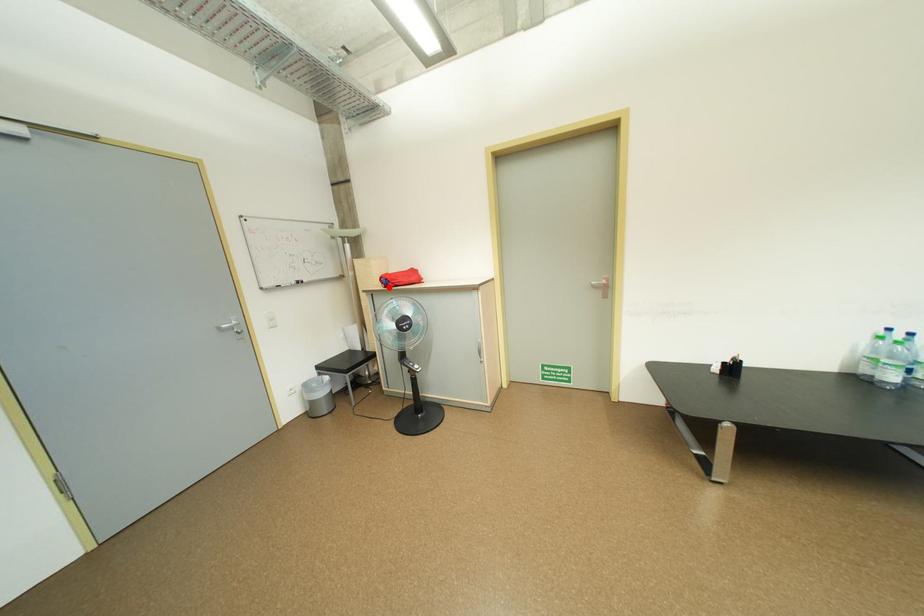
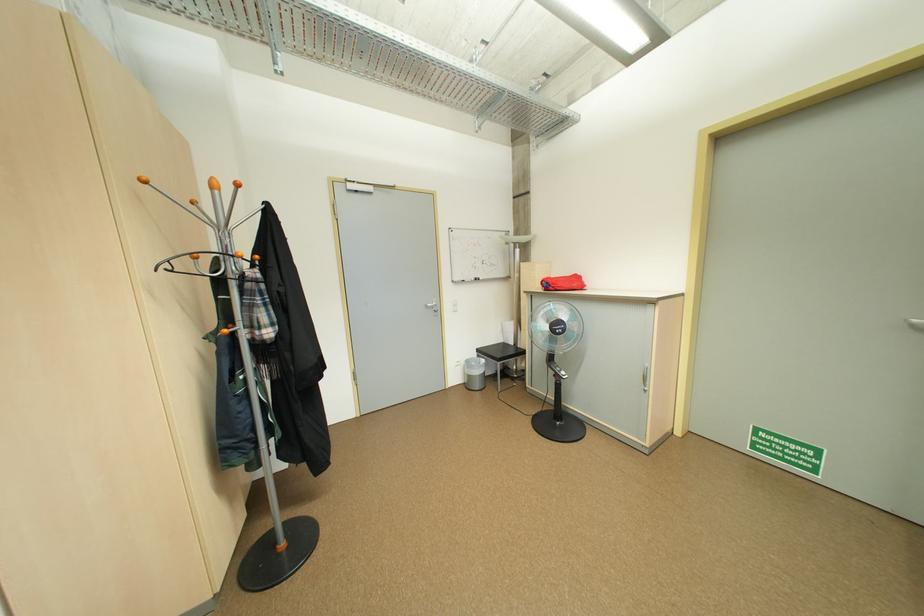
Locate, in the second image, the point that corresponds to the highlighted location in the first image.

(550, 290)